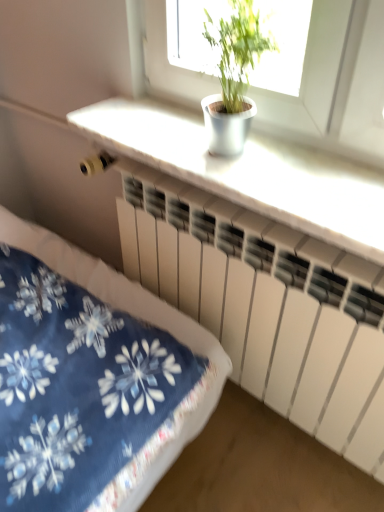
Locate an element on the screen. The width and height of the screenshot is (384, 512). vacant space behind green leafy plant at upper center is located at coordinates (190, 129).